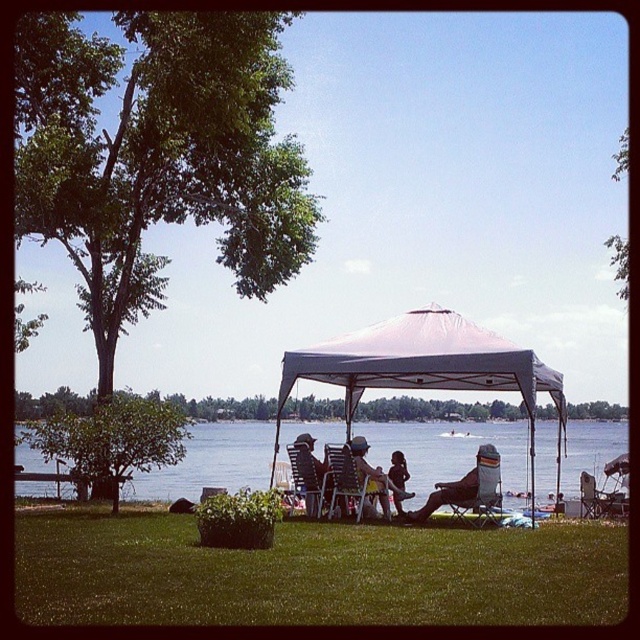
You are planning to take a photo of the clear blue water at center and the metallic silver chair at lower right. Based on their positions, which object should you place on the left side of your camera frame to ensure both are visible in the shot?

The clear blue water at center is positioned on the left side of metallic silver chair at lower right, so to ensure both are visible, you should place the clear blue water at center on the left side of your camera frame.

You are standing at the center of the grassy area and want to walk towards the point labeled as point (x=413, y=506). However, there is an obstacle at point (x=627, y=481). Will you encounter the obstacle before reaching your destination?

Since point (x=413, y=506) is behind point (x=627, y=481), you will encounter the obstacle at point (x=627, y=481) before reaching your destination point 0.791, 0.747.

You are a photographer planning to capture a photo of the clear blue water at center and the plastic folding chair at center. Based on their positions, which object will appear larger in the photo?

The clear blue water at center will appear larger in the photo because it is much taller than the plastic folding chair at center.